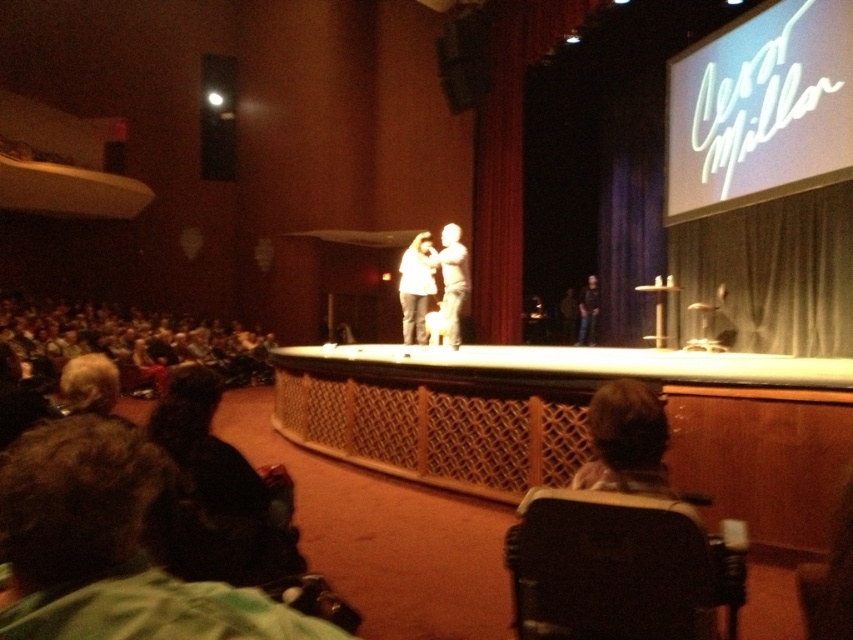
Is black plastic chair at lower right smaller than white fabric shirt at center?

Yes, black plastic chair at lower right is smaller than white fabric shirt at center.

Which is more to the right, black plastic chair at lower right or white fabric shirt at center?

From the viewer's perspective, black plastic chair at lower right appears more on the right side.

You are a GUI agent. You are given a task and a screenshot of the screen. Output one action in this format:
    pyautogui.click(x=<x>, y=<y>)
    Task: Click on the black plastic chair at lower right
    
    Given the screenshot: What is the action you would take?
    pyautogui.click(x=618, y=568)

Is white fabric shirt at center to the right of white matte shirt at center from the viewer's perspective?

Yes, white fabric shirt at center is to the right of white matte shirt at center.

Who is more distant from viewer, (451,280) or (404,339)?

The point (404,339) is behind.

At what (x,y) coordinates should I click in order to perform the action: click on white fabric shirt at center. Please return your answer as a coordinate pair (x, y). Looking at the image, I should click on (450, 284).

I want to click on white fabric shirt at center, so pyautogui.click(x=450, y=284).

Based on the photo, is black plastic chair at lower right taller than black fabric person at center?

No.

Who is lower down, black plastic chair at lower right or black fabric person at center?

black plastic chair at lower right is below.

Measure the distance between black plastic chair at lower right and camera.

The distance of black plastic chair at lower right from camera is 1.36 meters.

The image size is (853, 640). Identify the location of black plastic chair at lower right. (618, 568).